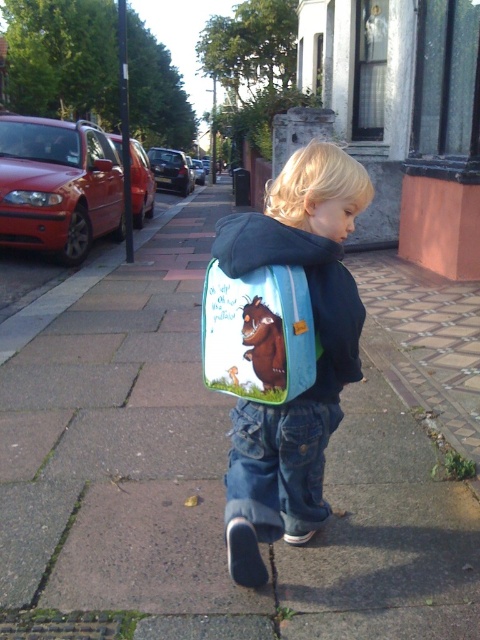
Question: Among these objects, which one is nearest to the camera?

Choices:
 (A) brown stone pavement at center
 (B) blue fabric sweatshirt at center
 (C) blue fabric lunchbox at center

Answer: (C)

Question: Is the position of brown stone pavement at center less distant than that of blue fabric backpack at center?

Choices:
 (A) yes
 (B) no

Answer: (B)

Question: Which point appears closest to the camera in this image?

Choices:
 (A) (123, 528)
 (B) (319, 289)
 (C) (253, 456)

Answer: (B)

Question: Which point is closer to the camera?

Choices:
 (A) (391, 465)
 (B) (231, 355)
 (C) (265, 216)
 (D) (335, 273)

Answer: (B)

Question: Is blue fabric backpack at center above blue fabric sweatshirt at center?

Choices:
 (A) yes
 (B) no

Answer: (B)

Question: Is blue fabric lunchbox at center below blue fabric sweatshirt at center?

Choices:
 (A) yes
 (B) no

Answer: (A)